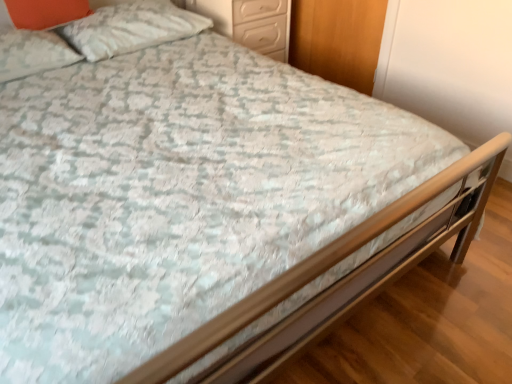
Question: Are white textured pillow at upper left, the first pillow in the right-to-left sequence, and orange matte pillow at upper left, which appears as the second pillow when viewed from the right, making contact?

Choices:
 (A) yes
 (B) no

Answer: (B)

Question: Can you confirm if white textured pillow at upper left, the first pillow in the right-to-left sequence, is bigger than orange matte pillow at upper left, which is the 2th pillow in left-to-right order?

Choices:
 (A) no
 (B) yes

Answer: (B)

Question: Is orange matte pillow at upper left, which appears as the second pillow when viewed from the right, at the back of white textured pillow at upper left, the first pillow in the right-to-left sequence?

Choices:
 (A) no
 (B) yes

Answer: (A)

Question: Is orange matte pillow at upper left, which is the 2th pillow in left-to-right order, completely or partially inside white textured pillow at upper left, the first pillow in the right-to-left sequence?

Choices:
 (A) yes
 (B) no

Answer: (B)

Question: Can you confirm if white textured pillow at upper left, the first pillow in the right-to-left sequence, is wider than orange matte pillow at upper left, which is the 2th pillow in left-to-right order?

Choices:
 (A) no
 (B) yes

Answer: (B)

Question: Relative to white glossy drawers at upper center, is orange matte pillow at upper left, which appears as the second pillow when viewed from the right, in front or behind?

Choices:
 (A) behind
 (B) front

Answer: (B)

Question: Considering the positions of orange matte pillow at upper left, which is the 2th pillow in left-to-right order, and white glossy drawers at upper center in the image, is orange matte pillow at upper left, which is the 2th pillow in left-to-right order, taller or shorter than white glossy drawers at upper center?

Choices:
 (A) short
 (B) tall

Answer: (A)

Question: From the image's perspective, is orange matte pillow at upper left, which appears as the second pillow when viewed from the right, positioned above or below white glossy drawers at upper center?

Choices:
 (A) above
 (B) below

Answer: (B)

Question: In terms of width, does orange matte pillow at upper left, which appears as the second pillow when viewed from the right, look wider or thinner when compared to white glossy drawers at upper center?

Choices:
 (A) wide
 (B) thin

Answer: (B)

Question: Considering their positions, is white soft pillow at upper left, the third pillow from the right, located in front of or behind white textured pillow at upper left, the first pillow in the right-to-left sequence?

Choices:
 (A) front
 (B) behind

Answer: (A)

Question: Is white soft pillow at upper left, the third pillow from the right, spatially inside white textured pillow at upper left, the 3th pillow viewed from the left, or outside of it?

Choices:
 (A) inside
 (B) outside

Answer: (B)

Question: Considering the positions of point (56, 43) and point (148, 24), is point (56, 43) closer or farther from the camera than point (148, 24)?

Choices:
 (A) farther
 (B) closer

Answer: (B)

Question: Considering the positions of white soft pillow at upper left, the third pillow from the right, and white textured pillow at upper left, the first pillow in the right-to-left sequence, in the image, is white soft pillow at upper left, the third pillow from the right, taller or shorter than white textured pillow at upper left, the first pillow in the right-to-left sequence,?

Choices:
 (A) tall
 (B) short

Answer: (A)

Question: Is white textured pillow at upper left, the first pillow in the right-to-left sequence, in front of or behind white glossy drawers at upper center in the image?

Choices:
 (A) front
 (B) behind

Answer: (A)

Question: Is white textured pillow at upper left, the first pillow in the right-to-left sequence, inside the boundaries of white glossy drawers at upper center, or outside?

Choices:
 (A) outside
 (B) inside

Answer: (A)